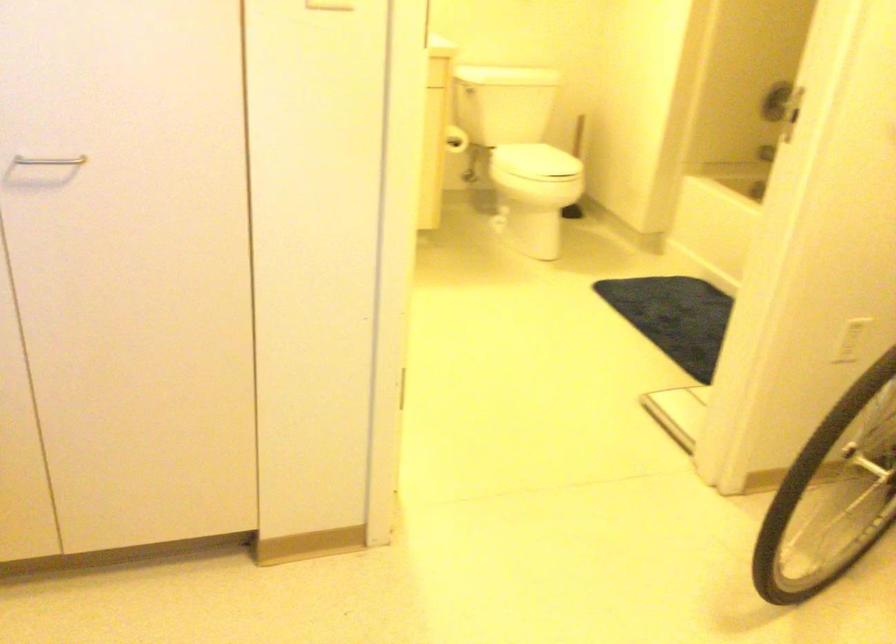
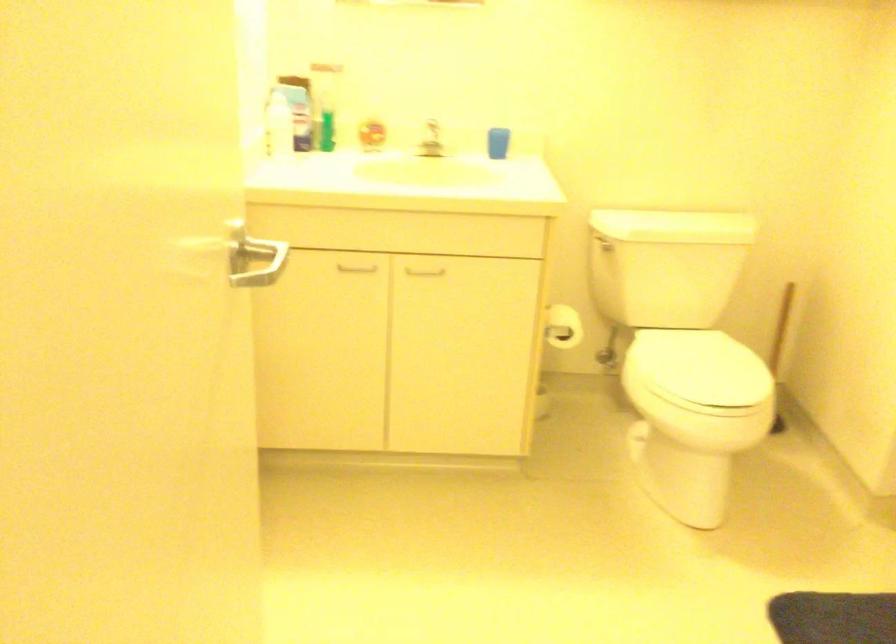
Question: What movement of the cameraman would produce the second image?

Choices:
 (A) Left
 (B) Right
 (C) Forward
 (D) Backward

Answer: (C)